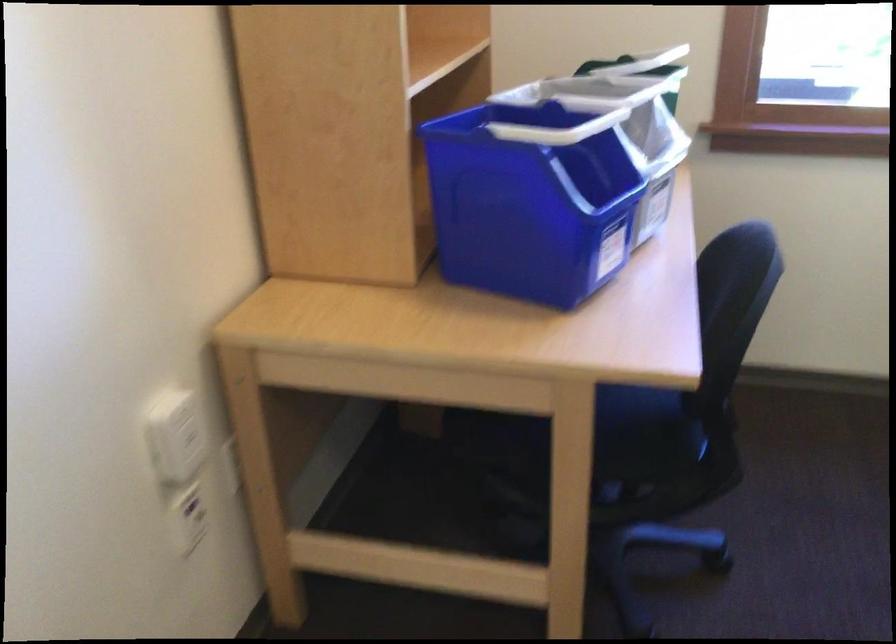
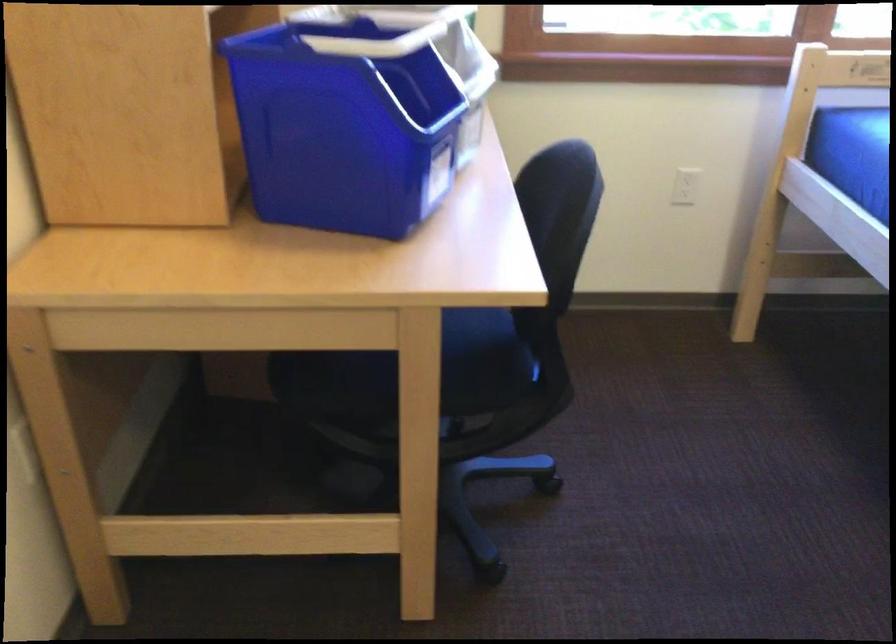
Find the pixel in the second image that matches (x=561, y=449) in the first image.

(409, 384)